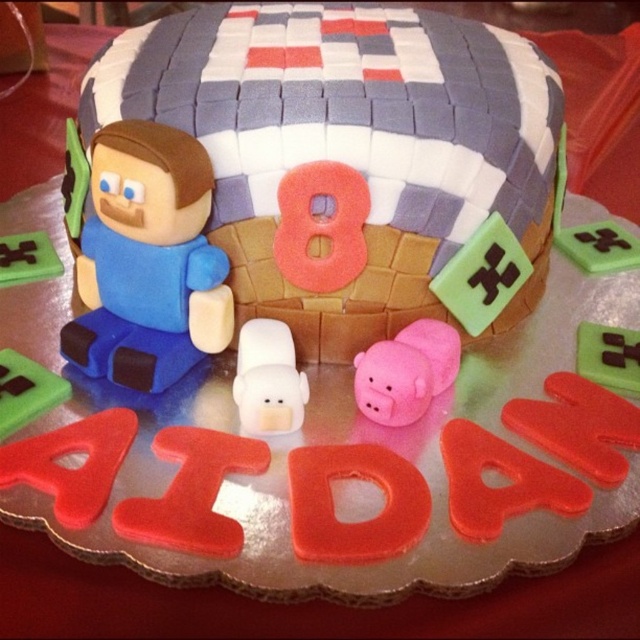
Question: Which point is farther from the camera taking this photo?

Choices:
 (A) (17, 374)
 (B) (433, 330)
 (C) (179, 276)
 (D) (392, 131)

Answer: (B)

Question: Is matte fondant cake at center closer to the viewer compared to green matte square at lower left?

Choices:
 (A) yes
 (B) no

Answer: (A)

Question: Considering the relative positions of matte fondant cake at center and green matte square at lower left in the image provided, where is matte fondant cake at center located with respect to green matte square at lower left?

Choices:
 (A) below
 (B) above

Answer: (B)

Question: Which object is the closest to the white matte pig at center?

Choices:
 (A) matte fondant cake at center
 (B) green matte square at lower left
 (C) blue fondant figure at left

Answer: (C)

Question: Is blue fondant figure at left bigger than green matte square at lower left?

Choices:
 (A) yes
 (B) no

Answer: (A)

Question: Which of the following is the closest to the observer?

Choices:
 (A) white matte pig at center
 (B) green matte square at lower left
 (C) blue fondant figure at left

Answer: (C)